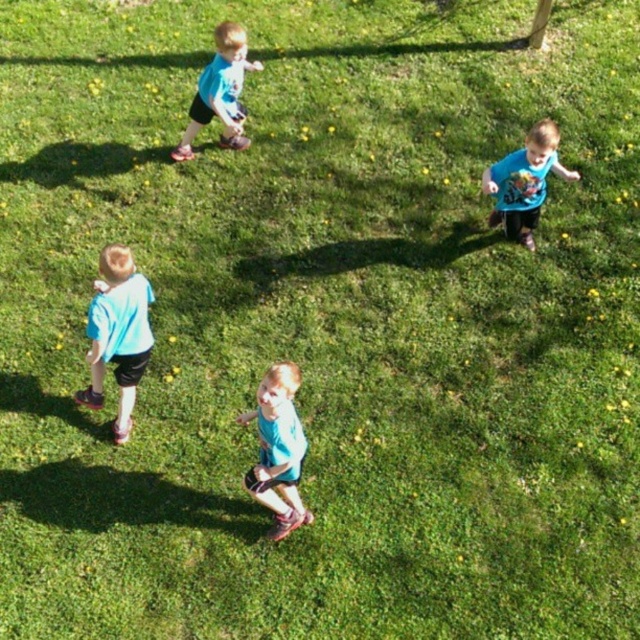
You are a photographer trying to capture a group photo of the children. You notice the blue matte shorts at center and the matte blue shirt at upper left. Which object should you focus on to ensure it takes up more of the frame?

The matte blue shirt at upper left should be focused on because it occupies more space than the blue matte shorts at center.

Looking at the scene, where is the blue matte shorts at center in relation to the blue matte shirt at upper right?

The blue matte shorts at center is to the left of the blue matte shirt at upper right.

You are standing at the point where the photographer was when taking the picture. You see two points marked in the image, point 1 at coordinates point 1 at point (276, 465) and point 2 at point (534, 218). If you want to walk towards point 2, which direction should you turn relative to point 1?

Since point 1 at point (276, 465) is in front of point 2 at point (534, 218), you should turn towards the direction away from point 1 to reach point 2.